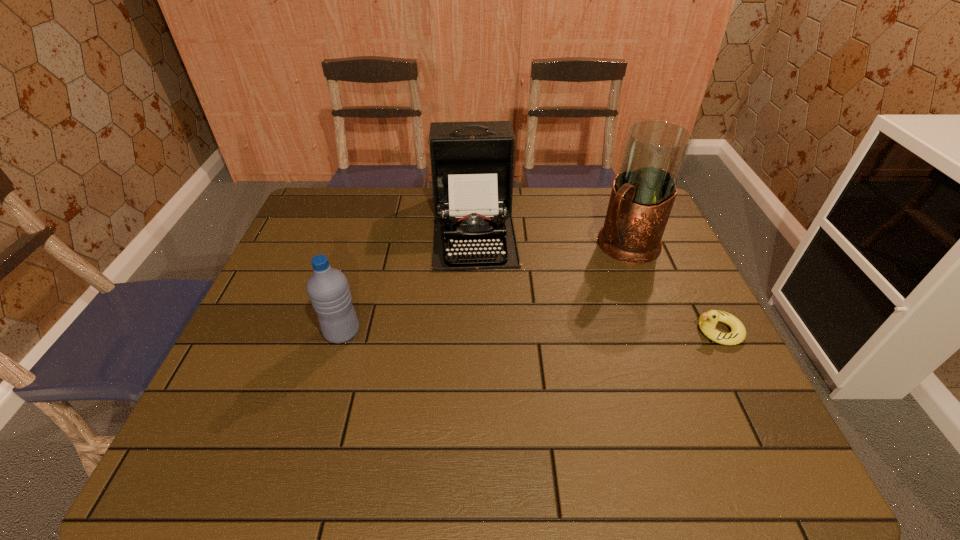
The width and height of the screenshot is (960, 540). I want to click on free spot located with the handle on the side of the pitcher, so click(592, 277).

This screenshot has height=540, width=960. I want to click on free space located with the handle on the side of the pitcher, so click(x=583, y=286).

You are a GUI agent. You are given a task and a screenshot of the screen. Output one action in this format:
    pyautogui.click(x=<x>, y=<y>)
    Task: Click on the vacant space situated with the handle on the side of the pitcher
    The height and width of the screenshot is (540, 960).
    Given the screenshot: What is the action you would take?
    pyautogui.click(x=528, y=334)

Where is `vacant point located 0.200m inside the open case of the typewriter`? This screenshot has height=540, width=960. vacant point located 0.200m inside the open case of the typewriter is located at coordinates (480, 324).

You are a GUI agent. You are given a task and a screenshot of the screen. Output one action in this format:
    pyautogui.click(x=<x>, y=<y>)
    Task: Click on the vacant point located inside the open case of the typewriter
    The width and height of the screenshot is (960, 540).
    Given the screenshot: What is the action you would take?
    pyautogui.click(x=478, y=304)

Where is `vacant area situated inside the open case of the typewriter`? The width and height of the screenshot is (960, 540). vacant area situated inside the open case of the typewriter is located at coordinates (482, 367).

You are a GUI agent. You are given a task and a screenshot of the screen. Output one action in this format:
    pyautogui.click(x=<x>, y=<y>)
    Task: Click on the pitcher positioned at the far edge
    
    Given the screenshot: What is the action you would take?
    pyautogui.click(x=643, y=193)

You are a GUI agent. You are given a task and a screenshot of the screen. Output one action in this format:
    pyautogui.click(x=<x>, y=<y>)
    Task: Click on the typewriter that is at the far edge
    The height and width of the screenshot is (540, 960).
    Given the screenshot: What is the action you would take?
    pyautogui.click(x=472, y=163)

This screenshot has height=540, width=960. I want to click on duckling at the right edge, so click(707, 322).

At what (x,y) coordinates should I click in order to perform the action: click on pitcher that is at the right edge. Please return your answer as a coordinate pair (x, y). The height and width of the screenshot is (540, 960). Looking at the image, I should click on (643, 193).